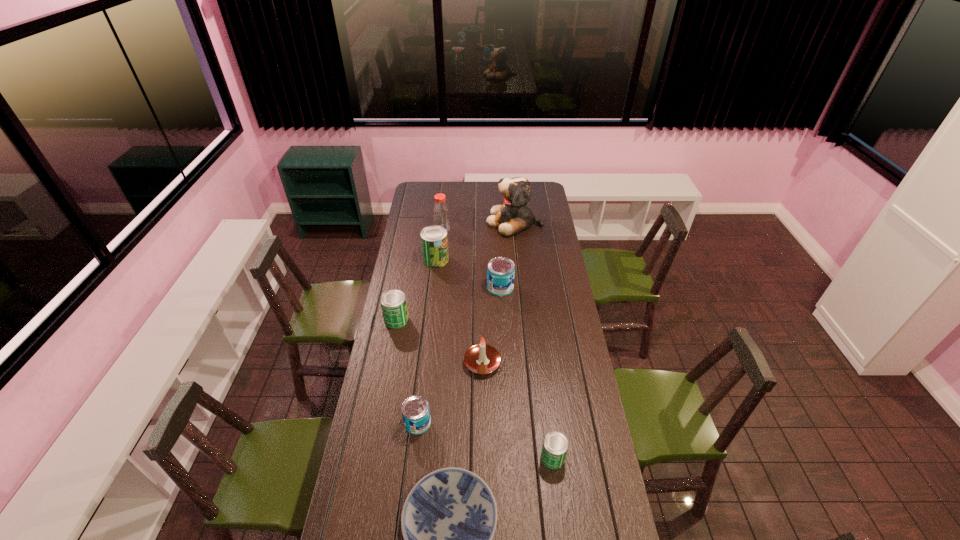
Find the location of `vacant region located on the front of the white candle`. vacant region located on the front of the white candle is located at coordinates (483, 449).

Identify the location of free space located 0.320m on the left of the sixth nearest object. (424, 287).

This screenshot has height=540, width=960. I want to click on free space located 0.160m on the right of the fifth farthest object, so click(443, 320).

Where is `vacant space located 0.050m on the right of the smallest green can`? vacant space located 0.050m on the right of the smallest green can is located at coordinates (579, 458).

This screenshot has height=540, width=960. Identify the location of vacant position located on the back of the third nearest object. (423, 375).

Identify the location of puppy that is at the right edge. (512, 217).

At what (x,y) coordinates should I click in order to perform the action: click on can located in the right edge section of the desktop. Please return your answer as a coordinate pair (x, y). The height and width of the screenshot is (540, 960). Looking at the image, I should click on (555, 445).

At what (x,y) coordinates should I click in order to perform the action: click on vacant space at the left edge of the desktop. Please return your answer as a coordinate pair (x, y). The height and width of the screenshot is (540, 960). Looking at the image, I should click on (390, 385).

Locate an element on the screen. free space at the right edge of the desktop is located at coordinates (538, 281).

Locate an element on the screen. The height and width of the screenshot is (540, 960). free space between the third nearest can and the tallest object is located at coordinates (456, 271).